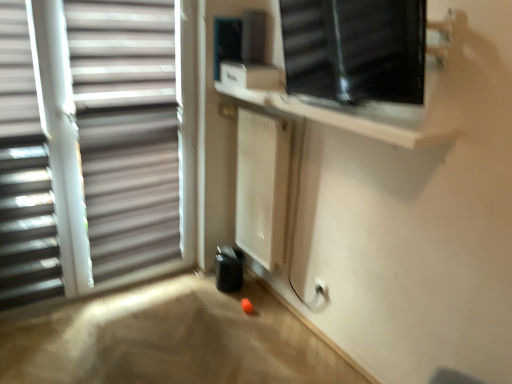
Identify the location of free spot below white matte radiator at center (from a real-world perspective). (256, 289).